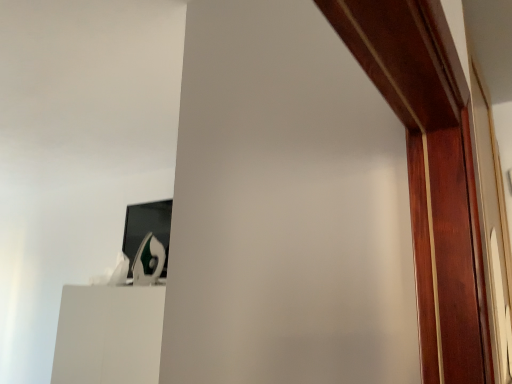
This screenshot has width=512, height=384. Describe the element at coordinates (109, 335) in the screenshot. I see `white glossy vanity at lower left` at that location.

Locate an element on the screen. This screenshot has height=384, width=512. white glossy vanity at lower left is located at coordinates (109, 335).

You are a GUI agent. You are given a task and a screenshot of the screen. Output one action in this format:
    pyautogui.click(x=<x>, y=<y>)
    Task: Click on the white glossy vanity at lower left
    
    Given the screenshot: What is the action you would take?
    pyautogui.click(x=109, y=335)